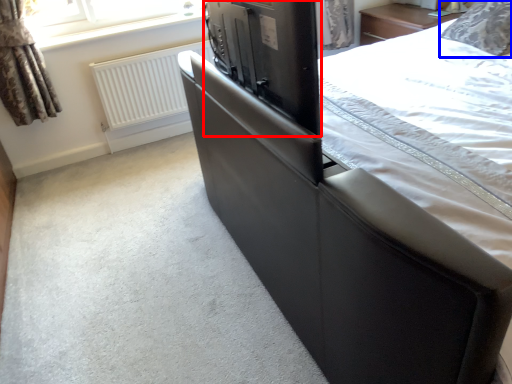
Question: Which object appears farthest to the camera in this image, appliance (highlighted by a red box) or pillow (highlighted by a blue box)?

Choices:
 (A) appliance
 (B) pillow

Answer: (B)